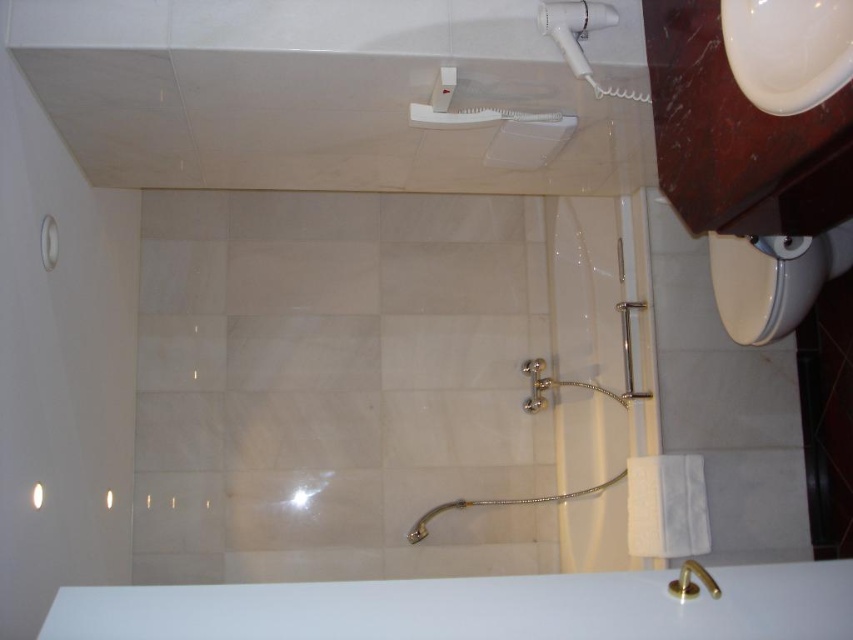
Based on the photo, you are a bathroom designer checking the layout. You need to ensure that the white glossy sink at upper right and the white plastic shower head at upper center are spaced appropriately. Which object is smaller in size?

The white glossy sink at upper right is smaller in size compared to the white plastic shower head at upper center.

You are standing in the bathroom and want to locate both the white glossy sink at upper right and the white plastic shower head at upper center. According to their positions, which one is positioned more to the right?

The white glossy sink at upper right is positioned more to the right than the white plastic shower head at upper center.

You are designing a bathroom layout and need to place both the white glossy toilet bowl at lower right and the white plastic hairdryer at upper right. Given their sizes, which object requires more horizontal space in the bathroom?

The white glossy toilet bowl at lower right requires more horizontal space because its width is larger than the white plastic hairdryer at upper right.